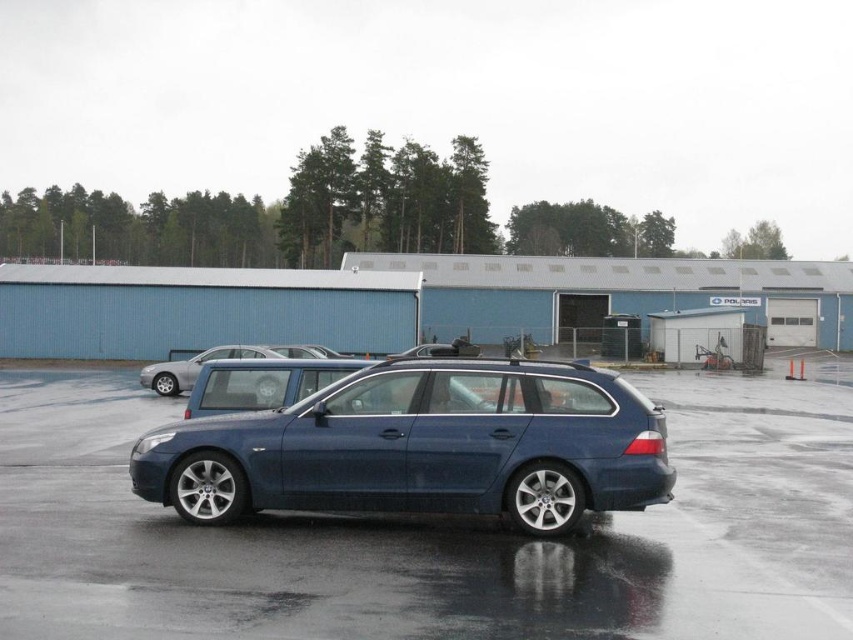
Question: Does metallic blue car at center have a lesser width compared to satin blue wagon at center?

Choices:
 (A) yes
 (B) no

Answer: (B)

Question: Can you confirm if metallic blue car at center is positioned below satin blue wagon at center?

Choices:
 (A) yes
 (B) no

Answer: (A)

Question: Is metallic blue car at center positioned behind satin blue wagon at center?

Choices:
 (A) no
 (B) yes

Answer: (A)

Question: Which object appears farthest from the camera in this image?

Choices:
 (A) satin blue wagon at center
 (B) metallic blue car at center

Answer: (A)